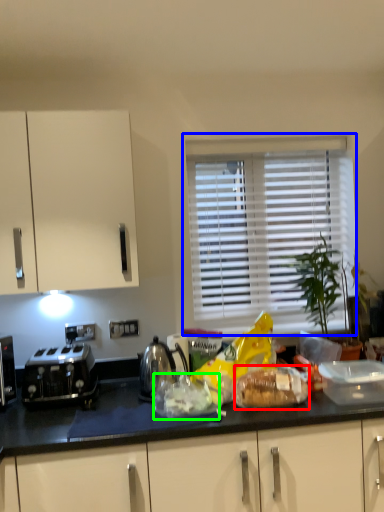
Question: Which object is the closest to the food (highlighted by a red box)? Choose among these: window (highlighted by a blue box) or food (highlighted by a green box).

Choices:
 (A) window
 (B) food

Answer: (B)